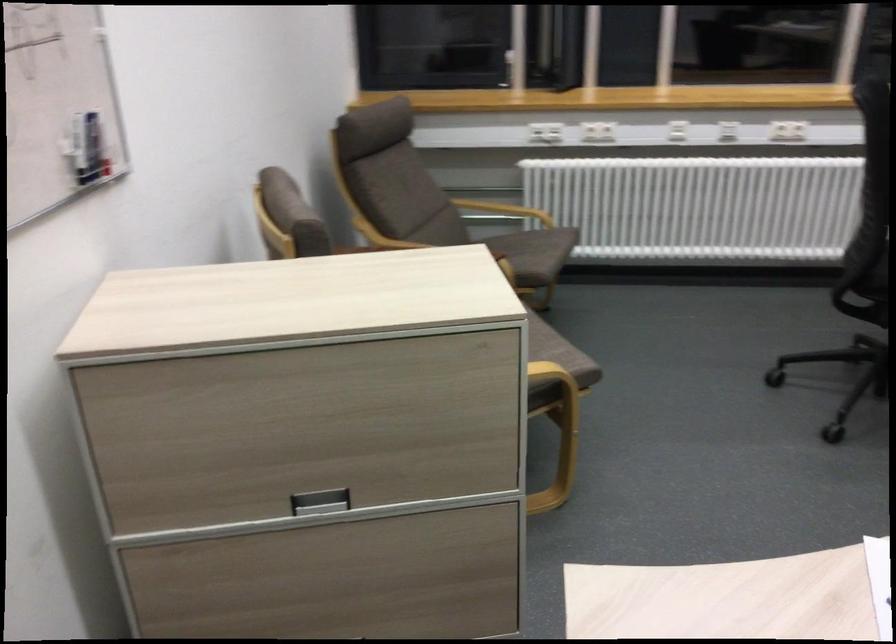
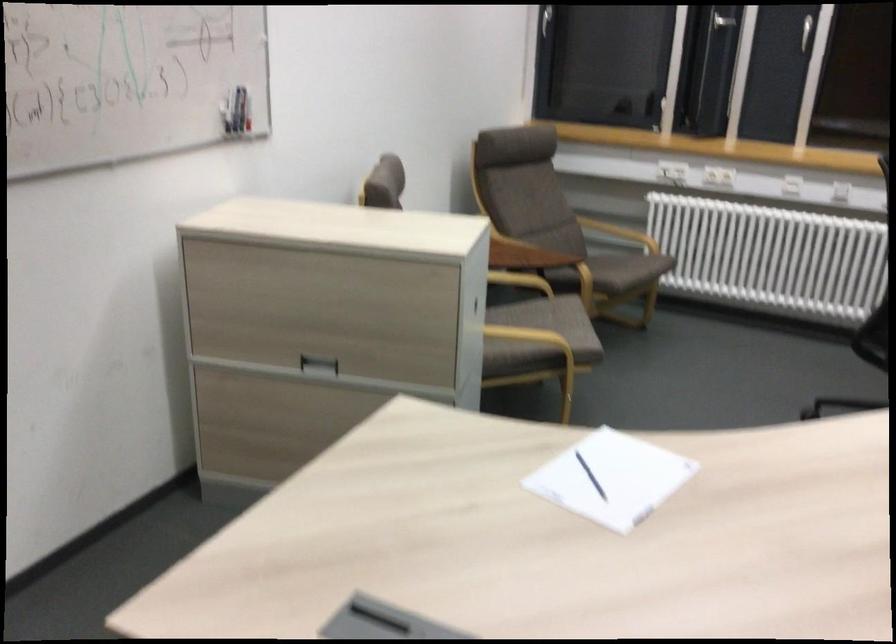
The point at (x=539, y=259) is marked in the first image. Where is the corresponding point in the second image?

(618, 270)